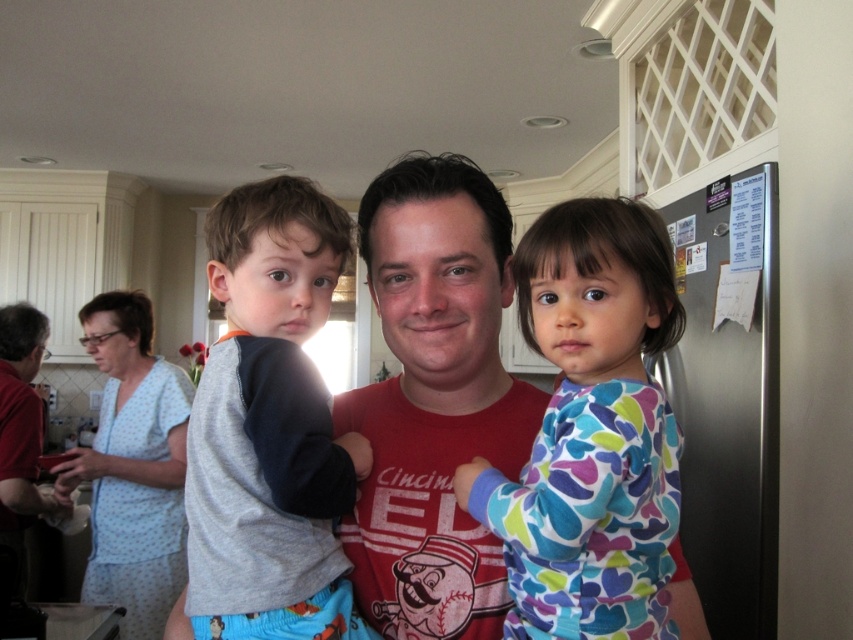
In the kitchen scene, there are two pieces of clothing visible in the background. The first is a gray fleece shirt at center and the second is a light blue dotted dress at left. Which one is positioned more to the right side of the image?

The gray fleece shirt at center is positioned more to the right side of the image compared to the light blue dotted dress at left.